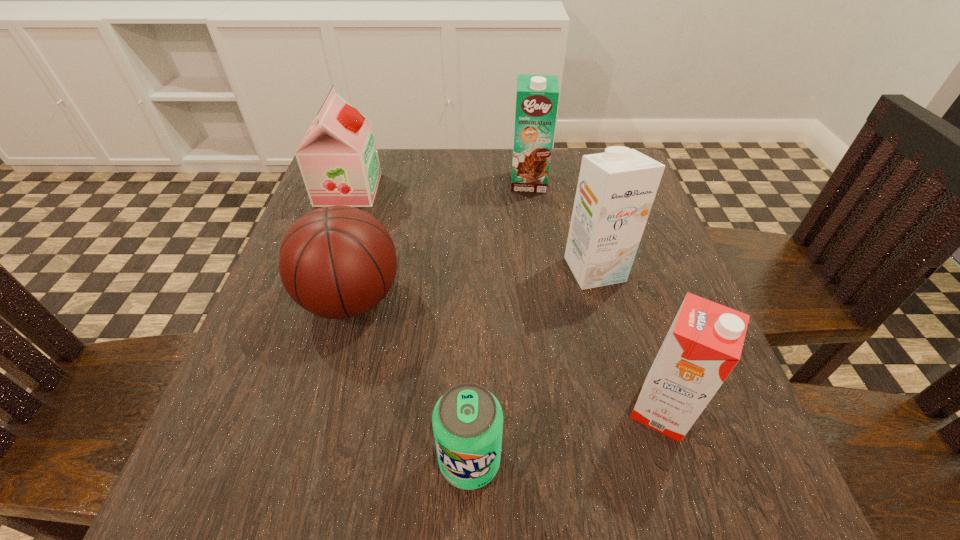
This screenshot has height=540, width=960. I want to click on the leftmost carton, so click(537, 96).

At what (x,y) coordinates should I click in order to perform the action: click on the third object from right to left. Please return your answer as a coordinate pair (x, y). This screenshot has height=540, width=960. Looking at the image, I should click on (537, 96).

Locate an element on the screen. the second nearest carton is located at coordinates (616, 189).

Image resolution: width=960 pixels, height=540 pixels. What are the coordinates of `soya milk` in the screenshot? It's located at (338, 159).

Where is `the shortest carton`? This screenshot has height=540, width=960. the shortest carton is located at coordinates (704, 343).

Where is `the fifth tallest object`? The height and width of the screenshot is (540, 960). the fifth tallest object is located at coordinates (336, 262).

I want to click on pop soda, so click(x=467, y=420).

Where is `the fourth object from right to left`? the fourth object from right to left is located at coordinates (467, 420).

Where is `free space located 0.070m on the front of the third object from right to left`? The height and width of the screenshot is (540, 960). free space located 0.070m on the front of the third object from right to left is located at coordinates (533, 211).

Find the location of a particular element. vacant space situated 0.280m on the back of the second nearest carton is located at coordinates (570, 174).